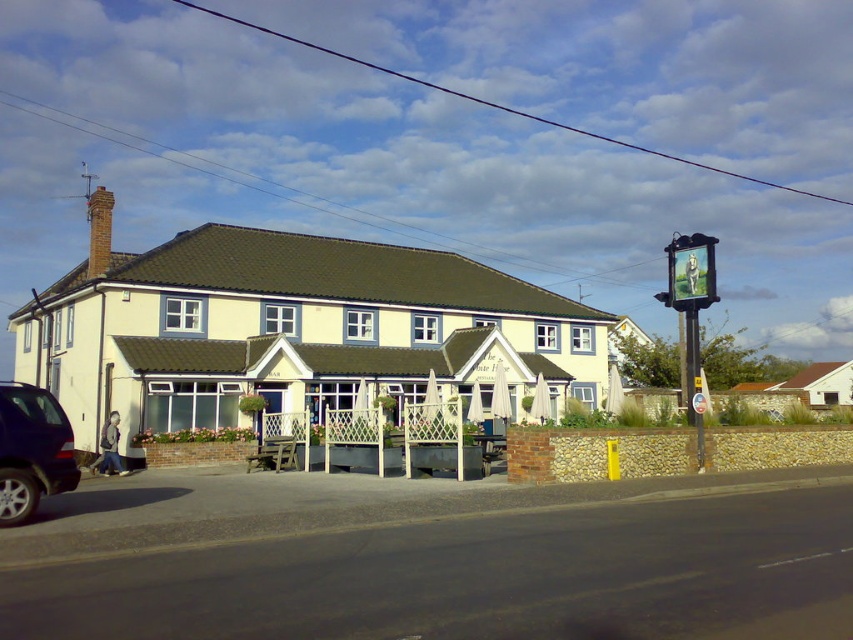
Is matte black suv at lower left further to the viewer compared to metallic signboard at upper right?

No, matte black suv at lower left is closer to the viewer.

Does point (3, 420) lie behind point (695, 308)?

No, it is in front of (695, 308).

Between point (53, 403) and point (693, 289), which one is positioned behind?

Positioned behind is point (693, 289).

The image size is (853, 640). Identify the location of matte black suv at lower left. (32, 451).